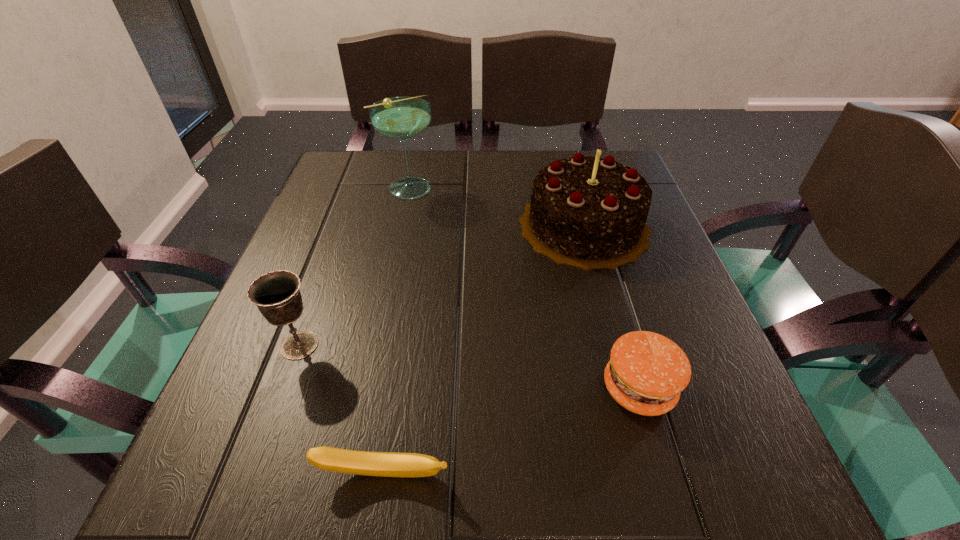
You are a GUI agent. You are given a task and a screenshot of the screen. Output one action in this format:
    pyautogui.click(x=<x>, y=<y>)
    Task: Click on the vacant point located between the third tallest object and the martini
    The image size is (960, 540).
    Given the screenshot: What is the action you would take?
    pyautogui.click(x=353, y=267)

The width and height of the screenshot is (960, 540). I want to click on empty space that is in between the martini and the patty, so click(523, 288).

This screenshot has width=960, height=540. Identify the location of vacant space that is in between the martini and the patty. (523, 288).

Identify which object is the fourth nearest to the birthday cake. Please provide its 2D coordinates. Your answer should be formatted as a tuple, i.e. [(x, y)], where the tuple contains the x and y coordinates of a point satisfying the conditions above.

[(386, 464)]

Image resolution: width=960 pixels, height=540 pixels. Identify the location of the closest object to the patty. (588, 212).

Locate an element on the screen. This screenshot has width=960, height=540. vacant region that satisfies the following two spatial constraints: 1. on the front side of the third tallest object; 2. on the left side of the patty is located at coordinates (284, 389).